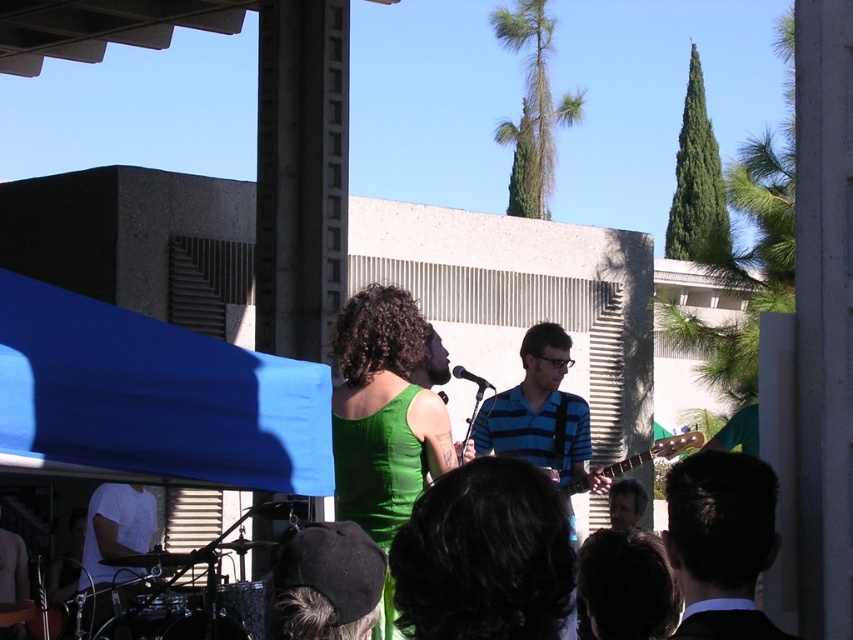
Between black felt hat at lower center and brown wooden guitar at center, which one is positioned higher?

black felt hat at lower center is higher up.

I want to click on black felt hat at lower center, so click(325, 582).

Is black suit at upper right shorter than blue striped shirt at center?

Incorrect, black suit at upper right's height does not fall short of blue striped shirt at center's.

Which is more to the right, black suit at upper right or blue striped shirt at center?

From the viewer's perspective, black suit at upper right appears more on the right side.

Which is behind, point (686, 493) or point (527, 388)?

The point (527, 388) is behind.

Where is `black suit at upper right`? This screenshot has height=640, width=853. black suit at upper right is located at coordinates (721, 544).

From the picture: Does green fabric tank top at center have a greater width compared to black suit at upper right?

Correct, the width of green fabric tank top at center exceeds that of black suit at upper right.

Who is more distant from viewer, (398, 401) or (699, 536)?

Positioned behind is point (398, 401).

Locate an element on the screen. green fabric tank top at center is located at coordinates (384, 412).